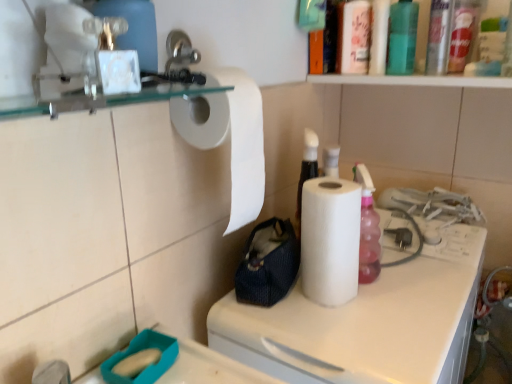
Locate an element on the screen. This screenshot has width=512, height=384. unoccupied region to the right of navy blue fabric pouch at center is located at coordinates point(368,307).